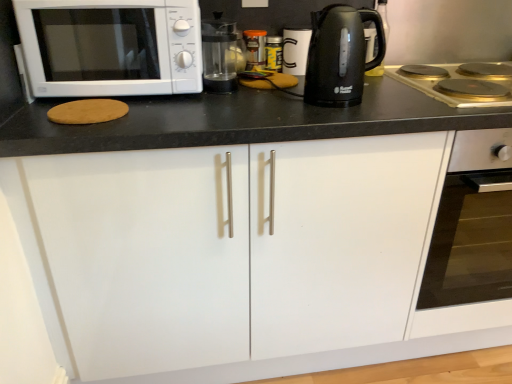
Locate an element on the screen. This screenshot has height=384, width=512. spots to the right of black glossy electric kettle at upper right is located at coordinates (410, 100).